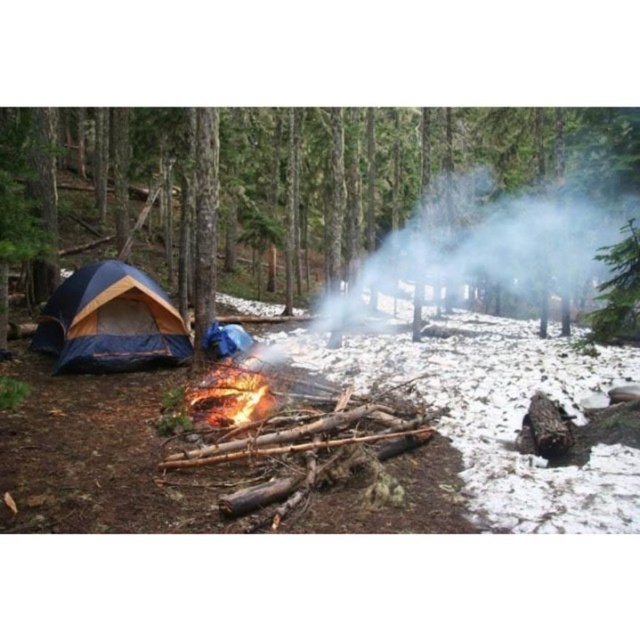
Can you confirm if blue fabric tent at left is thinner than flaming wood at center?

No, blue fabric tent at left is not thinner than flaming wood at center.

Between blue fabric tent at left and flaming wood at center, which one is positioned higher?

blue fabric tent at left is above.

Locate an element on the screen. This screenshot has height=640, width=640. blue fabric tent at left is located at coordinates (396, 179).

Is blue tarpaulin tent at left further to camera compared to flaming wood at center?

Yes, blue tarpaulin tent at left is further from the viewer.

Does blue tarpaulin tent at left appear on the left side of flaming wood at center?

Correct, you'll find blue tarpaulin tent at left to the left of flaming wood at center.

Between point (100, 324) and point (218, 371), which one is positioned in front?

Point (100, 324) is in front.

Identify the location of blue tarpaulin tent at left. (109, 321).

Does point (10, 145) lie behind point (72, 292)?

No, (10, 145) is in front of (72, 292).

Measure the distance between blue fabric tent at left and camera.

blue fabric tent at left and camera are 4.12 meters apart from each other.

Describe the element at coordinates (396, 179) in the screenshot. I see `blue fabric tent at left` at that location.

Find the location of `blue fabric tent at left`. blue fabric tent at left is located at coordinates (396, 179).